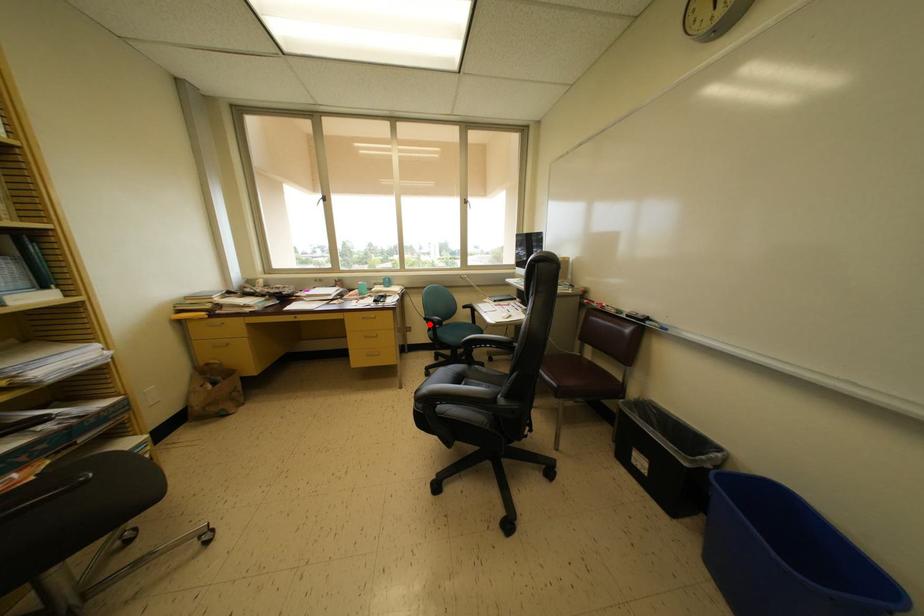
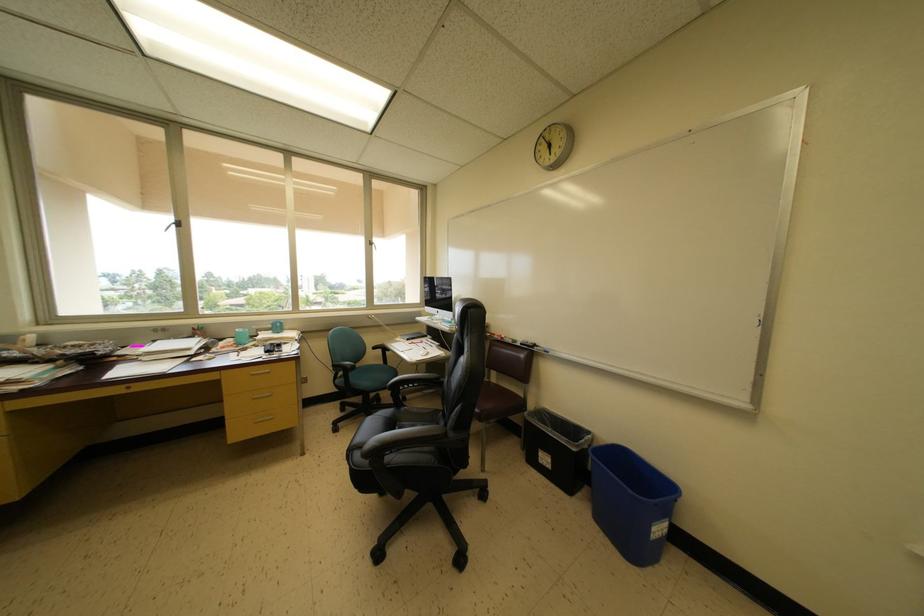
Question: I am providing you with two images of the same scene from different viewpoints. Image1 has a red point marked. In image2, the corresponding 3D location appears at what relative position? Reply with the corresponding letter.

Choices:
 (A) Closer
 (B) Farther

Answer: (A)